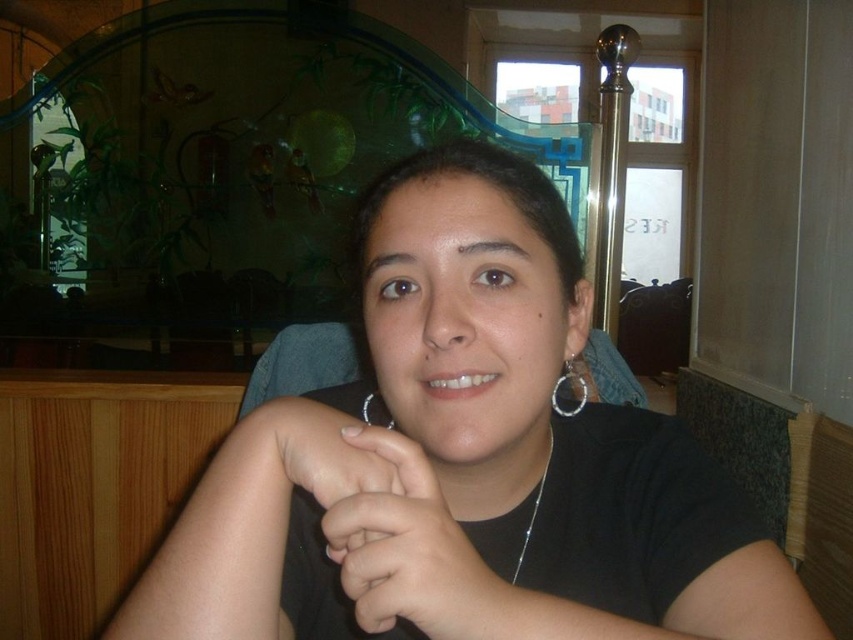
You are a photographer trying to capture the subject in the image. If you want to focus on the silver metallic hoop at center without including the black matte shirt at center in the shot, where should you position your camera relative to the current viewpoint?

The black matte shirt at center is located below the silver metallic hoop at center. To avoid including the black matte shirt at center in the shot, position the camera higher so that the silver metallic hoop at center is framed above the shirt.

You are a photographer trying to capture a closeup of the silver metallic necklace at center and the black matte hand at center. From the perspective of the camera lens, which object is positioned to the right?

The black matte hand at center is positioned to the right of the silver metallic necklace at center according to the description.

You are standing at a distance of 1 meter from the glass partition in the scene. There is a point at coordinates point [368,536]. Can you reach this point without moving closer than your current position?

The distance of point [368,536] from viewer is 37.68 centimeters, so yes, you can reach it without moving closer than your current position since it is within arm reach.